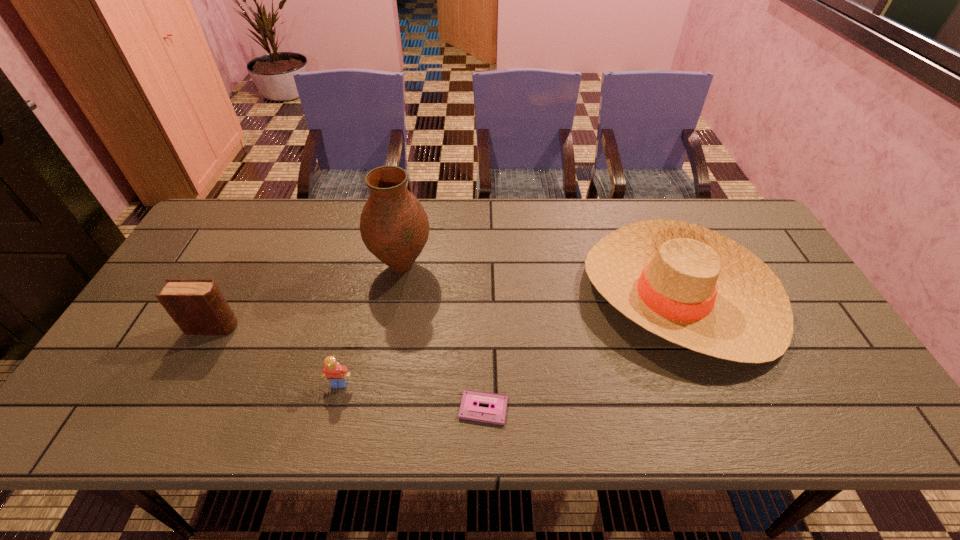
Find the location of a particular element. vase is located at coordinates (394, 226).

Locate an element on the screen. Image resolution: width=960 pixels, height=540 pixels. the leftmost object is located at coordinates (197, 306).

At what (x,y) coordinates should I click in order to perform the action: click on sunhat. Please return your answer as a coordinate pair (x, y). This screenshot has width=960, height=540. Looking at the image, I should click on (692, 286).

Find the location of a particular element. This screenshot has height=540, width=960. the fourth tallest object is located at coordinates (337, 374).

The width and height of the screenshot is (960, 540). Identify the location of Lego. (337, 374).

In order to click on the shortest object in this screenshot , I will do `click(468, 410)`.

Find the location of a particular element. This screenshot has height=540, width=960. the second object from right to left is located at coordinates (468, 410).

You are a GUI agent. You are given a task and a screenshot of the screen. Output one action in this format:
    pyautogui.click(x=<x>, y=<y>)
    Task: Click on the vacant space located on the left of the tallest object
    This screenshot has height=540, width=960.
    Given the screenshot: What is the action you would take?
    pyautogui.click(x=333, y=267)

Where is `vacant point located on the spine side of the diary`? vacant point located on the spine side of the diary is located at coordinates (288, 327).

Find the location of a particular element. vacant space situated on the back of the sunhat is located at coordinates pos(638,202).